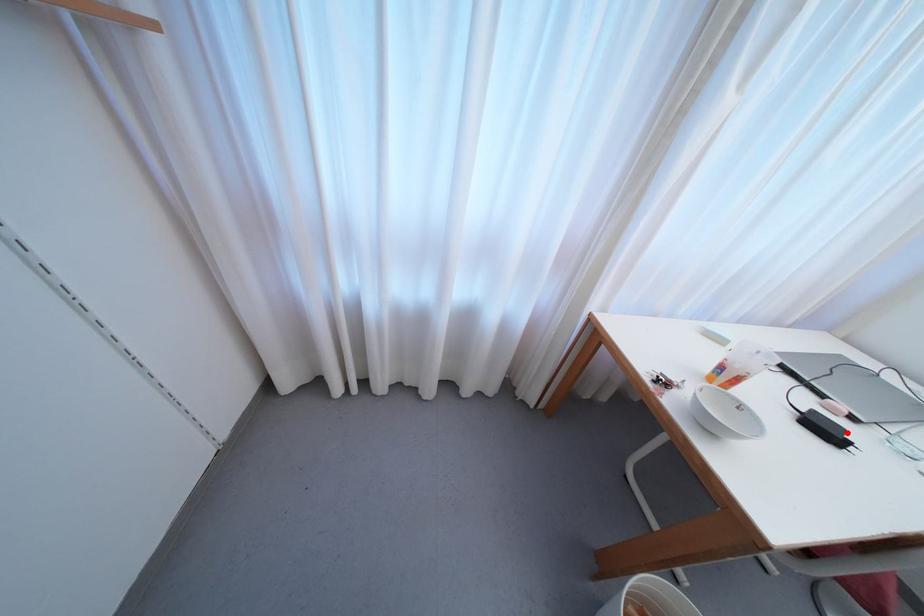
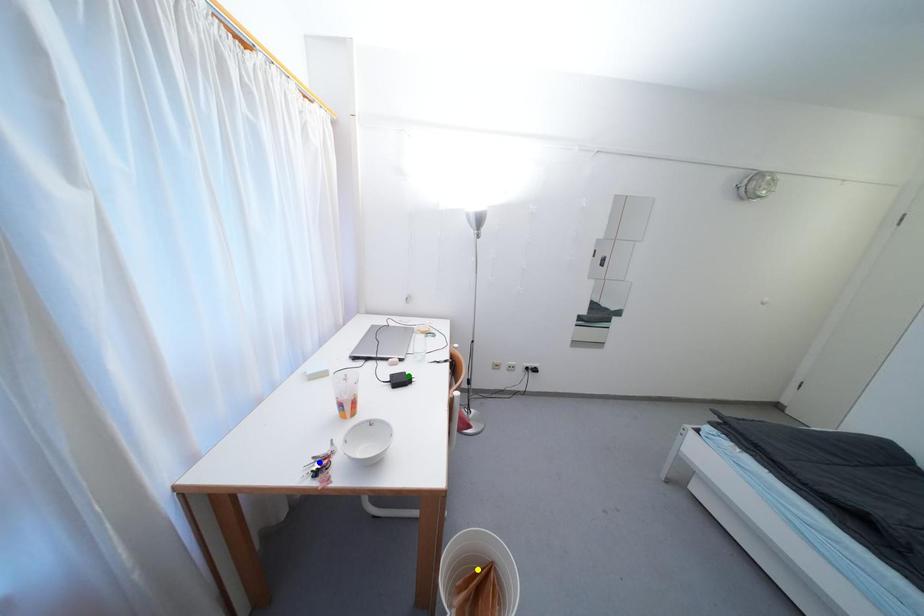
Question: I am providing you with two images of the same scene from different viewpoints. A red point is marked on the first image. You are given multiple points on the second image. Can you choose the point in image 2 that corresponds to the point in image 1?

Choices:
 (A) yellow point
 (B) blue point
 (C) green point

Answer: (C)